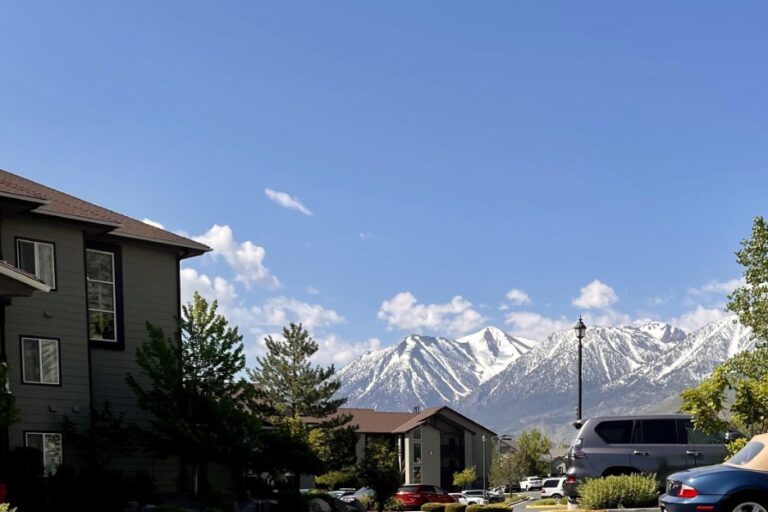
This screenshot has width=768, height=512. Find the location of `windows`. windows is located at coordinates (35, 342), (38, 258), (93, 275), (45, 437), (416, 436), (418, 455), (416, 473).